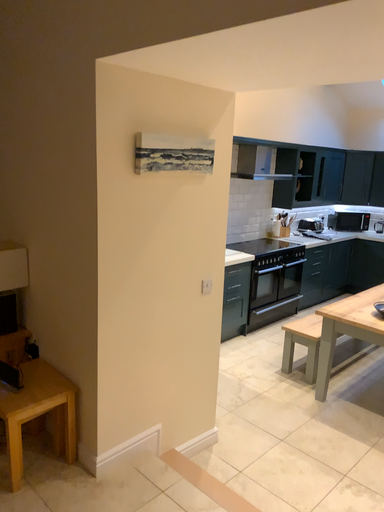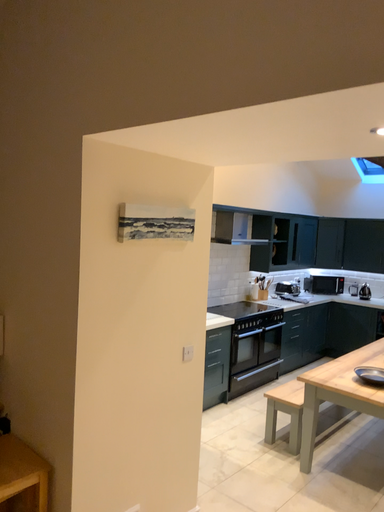
Question: How did the camera likely rotate when shooting the video?

Choices:
 (A) rotated upward
 (B) rotated downward

Answer: (A)